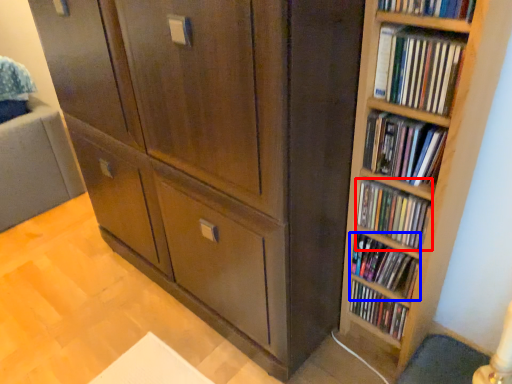
Question: Which point is closer to the camera, book (highlighted by a red box) or book (highlighted by a blue box)?

Choices:
 (A) book
 (B) book

Answer: (A)